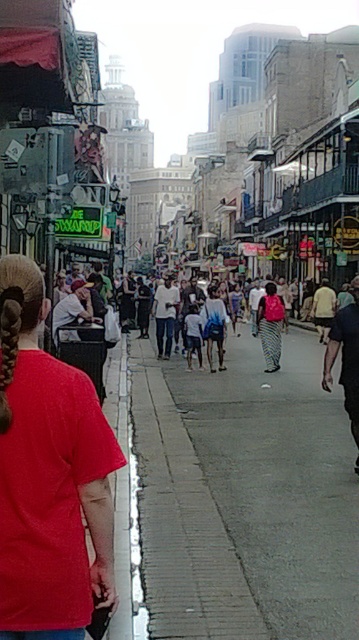
Does gray concrete sidewalk at center appear on the right side of white matte shirt at center?

Indeed, gray concrete sidewalk at center is positioned on the right side of white matte shirt at center.

Can you confirm if gray concrete sidewalk at center is positioned above white matte shirt at center?

Incorrect, gray concrete sidewalk at center is not positioned above white matte shirt at center.

Which is behind, point (235, 547) or point (164, 328)?

The point (164, 328) is behind.

Identify the location of gray concrete sidewalk at center. This screenshot has width=359, height=640. (277, 481).

Between braided hair at center and patterned fabric dress at center, which one has less height?

With less height is patterned fabric dress at center.

Describe the element at coordinates (16, 317) in the screenshot. I see `braided hair at center` at that location.

Does point (31, 266) lie in front of point (262, 298)?

Yes, it is.

You are a GUI agent. You are given a task and a screenshot of the screen. Output one action in this format:
    pyautogui.click(x=<x>, y=<y>)
    Task: Click on the braided hair at center
    The height and width of the screenshot is (640, 359).
    Given the screenshot: What is the action you would take?
    pyautogui.click(x=16, y=317)

What are the coordinates of `red t-shirt at center` in the screenshot? It's located at (48, 476).

Is red t-shirt at center to the left of white matte shirt at center from the viewer's perspective?

Correct, you'll find red t-shirt at center to the left of white matte shirt at center.

Who is more distant from viewer, (99, 484) or (160, 333)?

The point (160, 333) is more distant.

At what (x,y) coordinates should I click in order to perform the action: click on red t-shirt at center. Please return your answer as a coordinate pair (x, y). This screenshot has width=359, height=640. Looking at the image, I should click on (48, 476).